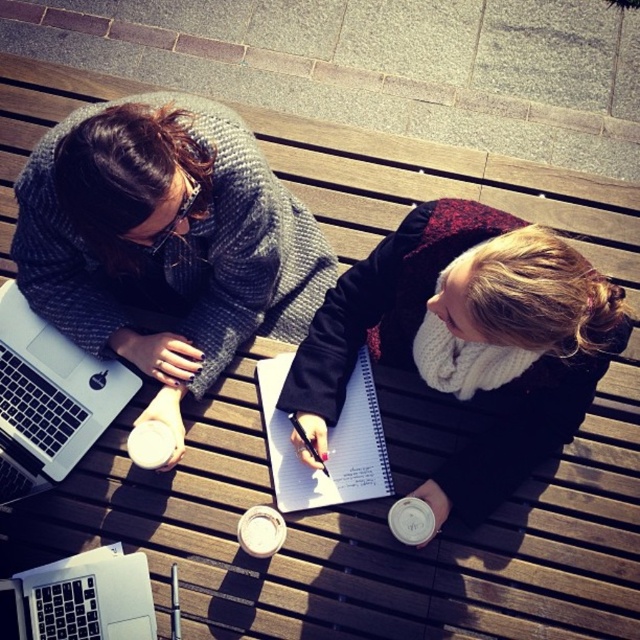
You are a photographer positioned at the center of the scene. You want to take a photo that includes both the matte black scarf at upper left and the person on the right wearing a black jacket with red accents. Based on their positions, which object is closer to the center of the scene?

The matte black scarf at upper left is located at point (164, 241), which is closer to the center of the scene compared to the person on the right wearing a black jacket with red accents. Therefore, the scarf is nearer to the center.

You are a delivery person who needs to place a small package between the matte black scarf at upper left and the silver metallic laptop at lower left on the bench. The package is 10 inches long. Is there enough space between them to fit the package?

The distance between the matte black scarf at upper left and the silver metallic laptop at lower left is 20.59 inches. Since the package is 10 inches long, there is sufficient space to place it between them.